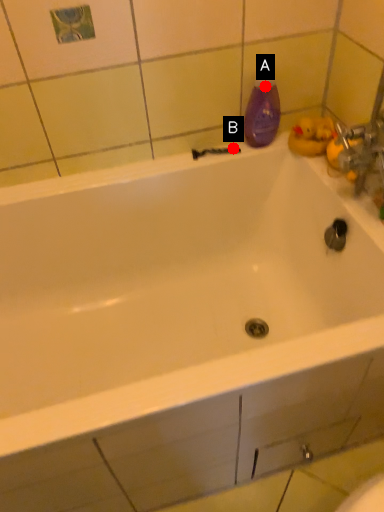
Question: Two points are circled on the image, labeled by A and B beside each circle. Which point appears closest to the camera in this image?

Choices:
 (A) A is closer
 (B) B is closer

Answer: (A)